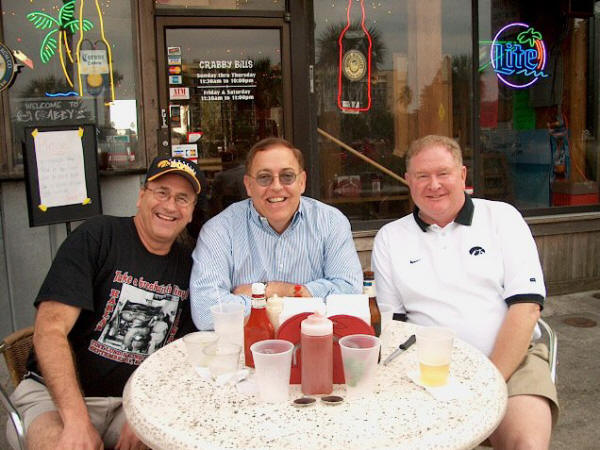
The height and width of the screenshot is (450, 600). In order to click on front door in this screenshot , I will do `click(233, 122)`.